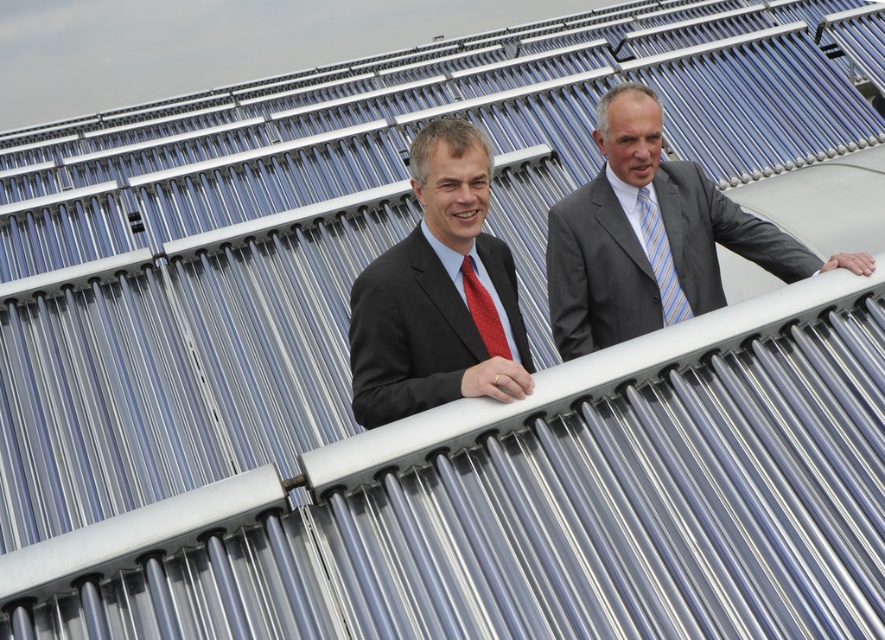
Please look at the image and locate the point at coordinates (439, 292). What object is closest to this point?

The point at coordinates (439, 292) is closest to the matte black suit at center.

You are a photographer taking a picture of the gray suit at center and the striped silk tie at center. Which object should you focus on first to ensure both are in sharp focus?

The gray suit at center is located above striped silk tie at center, so you should focus on the gray suit at center first to ensure both are in sharp focus.